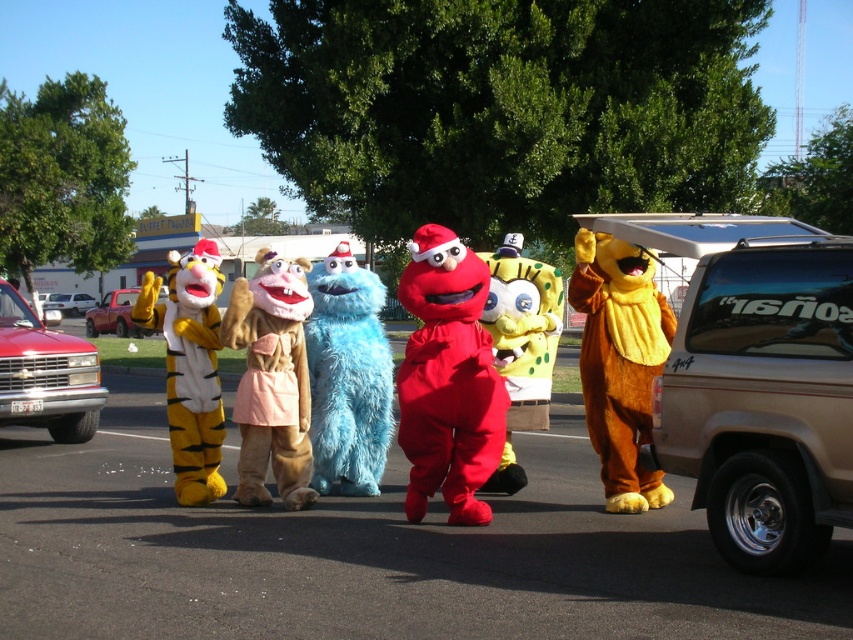
Question: Which point is farther to the camera?

Choices:
 (A) (166, 320)
 (B) (323, 330)
 (C) (798, 410)

Answer: (B)

Question: Does tan metallic truck at right come behind fuzzy brown bear at center?

Choices:
 (A) no
 (B) yes

Answer: (A)

Question: Can you confirm if fuzzy brown bear at center is thinner than yellow plush tiger at left?

Choices:
 (A) yes
 (B) no

Answer: (A)

Question: Which is farther from the brown plush puppet at center?

Choices:
 (A) smooth asphalt parking lot at center
 (B) white plastic car at left

Answer: (B)

Question: Among these objects, which one is farthest from the camera?

Choices:
 (A) metallic red truck at left
 (B) brown plush puppet at center
 (C) white plastic car at left

Answer: (C)

Question: Does matte red costume at center appear on the left side of fuzzy brown bear at center?

Choices:
 (A) yes
 (B) no

Answer: (A)